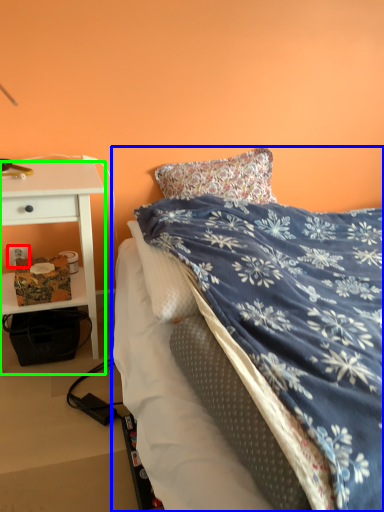
Question: Estimate the real-world distances between objects in this image. Which object is closer to power outlet (highlighted by a red box), bed (highlighted by a blue box) or desk (highlighted by a green box)?

Choices:
 (A) bed
 (B) desk

Answer: (B)